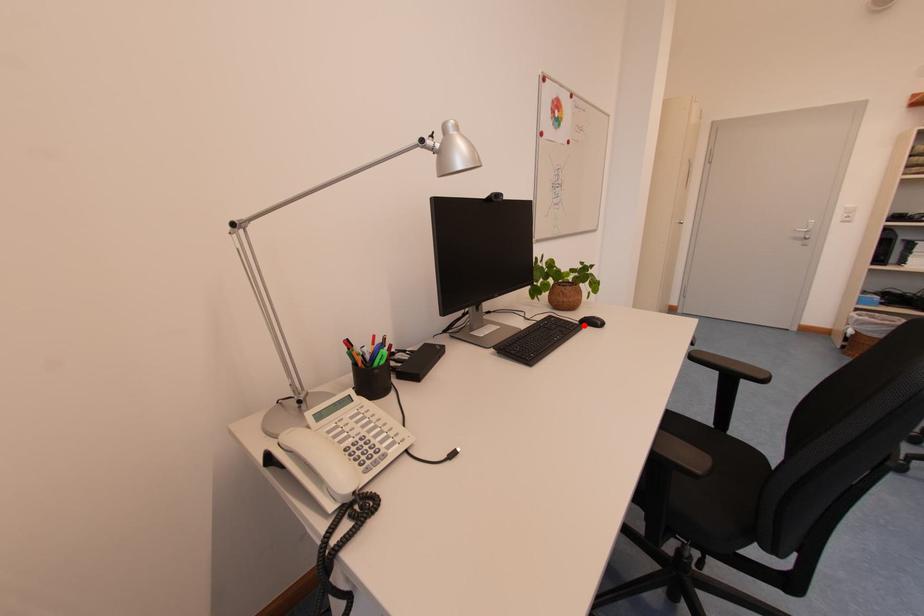
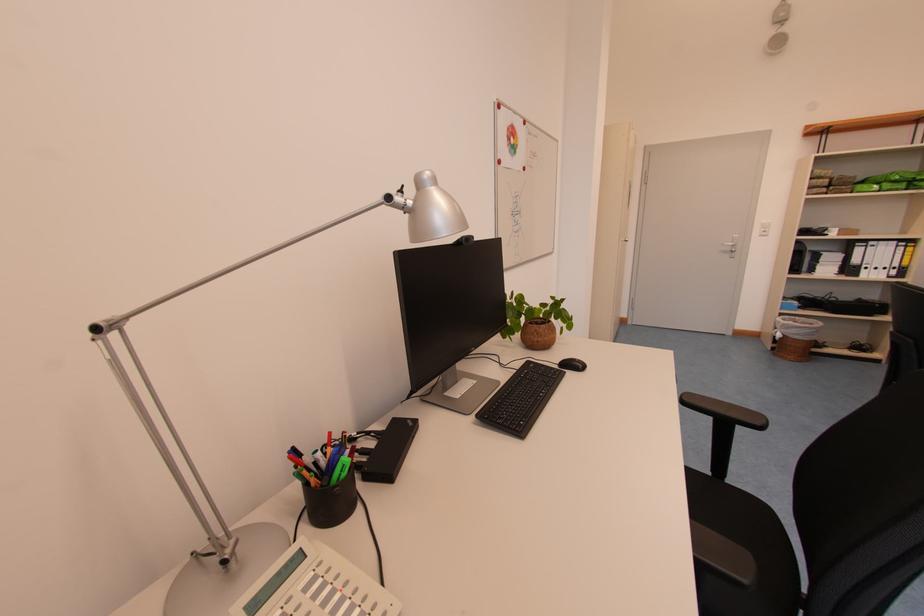
Where in the second image is the point corresponding to the highlighted location from the first image?

(564, 369)